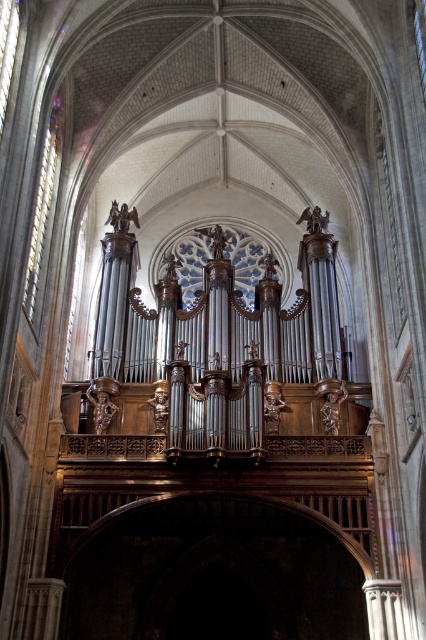
Is transparent stained glass at center wider than clear glass window at left?

Indeed, transparent stained glass at center has a greater width compared to clear glass window at left.

Does point (192, 248) come farther from viewer compared to point (54, 112)?

Yes, it is.

This screenshot has height=640, width=426. In order to click on transparent stained glass at center in this screenshot , I will do `click(244, 260)`.